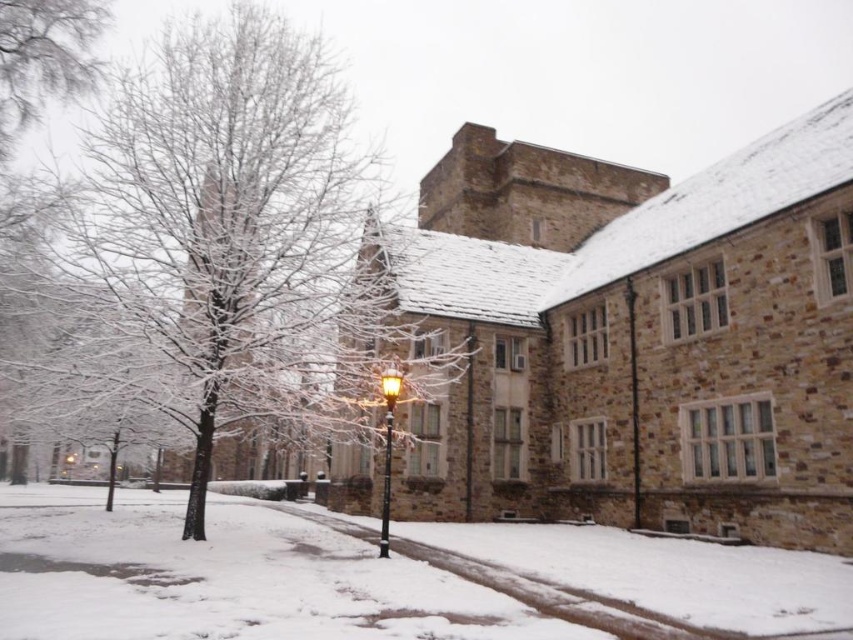
Question: Among these objects, which one is nearest to the camera?

Choices:
 (A) white powdery snow at center
 (B) snow-covered tree at center-left
 (C) matte black lamp post at center

Answer: (A)

Question: Does snow-covered tree at center-left appear under white powdery snow at center?

Choices:
 (A) no
 (B) yes

Answer: (A)

Question: Does white powdery snow at center appear under matte black lamp post at center?

Choices:
 (A) no
 (B) yes

Answer: (B)

Question: Which of the following is the farthest from the observer?

Choices:
 (A) matte black lamp post at center
 (B) white powdery snow at center

Answer: (A)

Question: Which object is the closest to the snowy bare branches at upper left?

Choices:
 (A) snow-covered tree at center-left
 (B) matte black lamp post at center

Answer: (A)

Question: Is white powdery snow at center positioned in front of snowy bare branches at upper left?

Choices:
 (A) yes
 (B) no

Answer: (A)